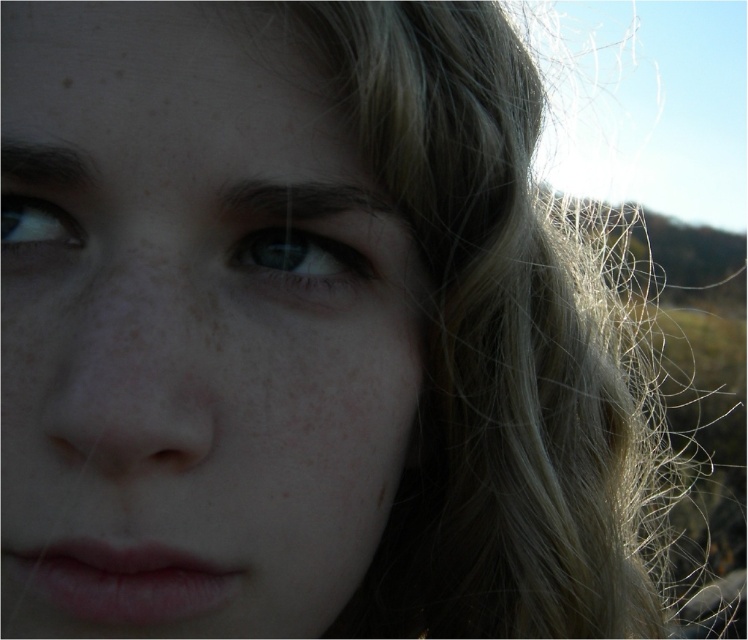
Question: Does smooth skin face at center have a greater width compared to matte blue eye at upper left?

Choices:
 (A) no
 (B) yes

Answer: (B)

Question: In this image, where is blue glossy eye at center located relative to matte blue eye at upper left?

Choices:
 (A) left
 (B) right

Answer: (B)

Question: Which object is farther from the camera taking this photo?

Choices:
 (A) smooth skin face at center
 (B) matte blue eye at upper left

Answer: (B)

Question: Can you confirm if smooth skin face at center is positioned above blue glossy eye at center?

Choices:
 (A) yes
 (B) no

Answer: (B)

Question: Based on their relative distances, which object is farther from the blue glossy eye at center?

Choices:
 (A) smooth skin face at center
 (B) matte blue eye at upper left

Answer: (B)

Question: Estimate the real-world distances between objects in this image. Which object is closer to the matte blue eye at upper left?

Choices:
 (A) smooth skin face at center
 (B) blue glossy eye at center

Answer: (A)